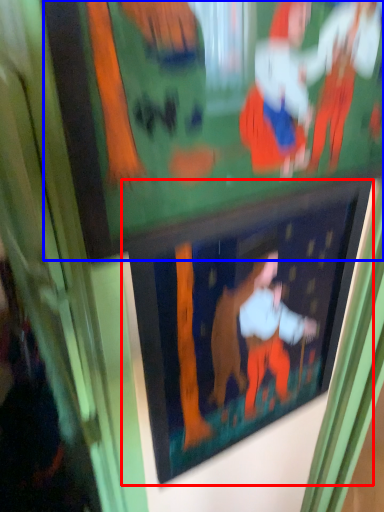
Question: Which object is closer to the camera taking this photo, picture frame (highlighted by a red box) or bulletin board (highlighted by a blue box)?

Choices:
 (A) picture frame
 (B) bulletin board

Answer: (B)